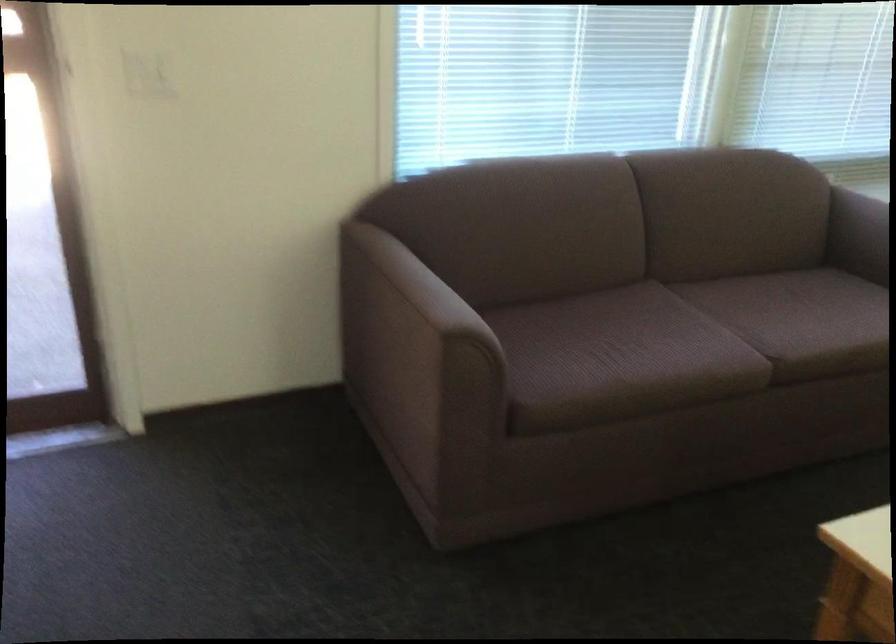
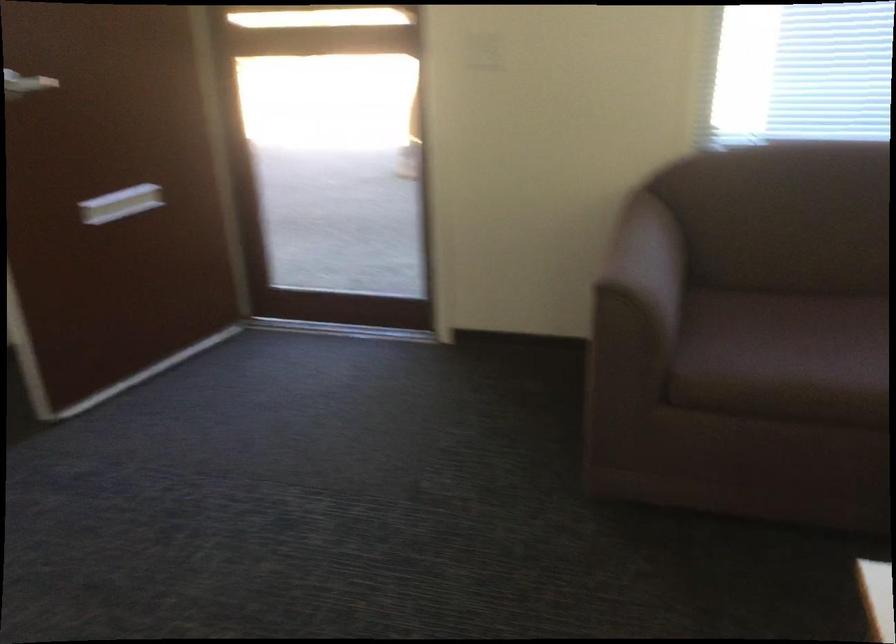
Locate, in the second image, the point that corresponds to point (453, 301) in the first image.

(648, 261)